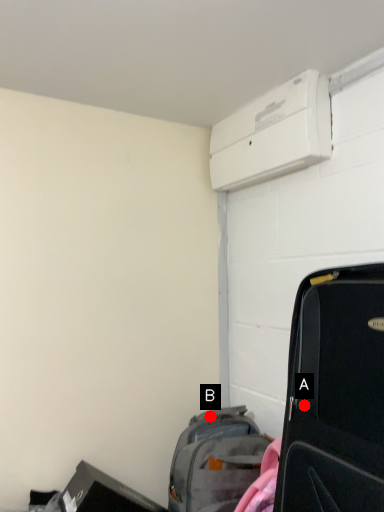
Question: Two points are circled on the image, labeled by A and B beside each circle. Among these points, which one is farthest from the camera?

Choices:
 (A) A is further
 (B) B is further

Answer: (B)